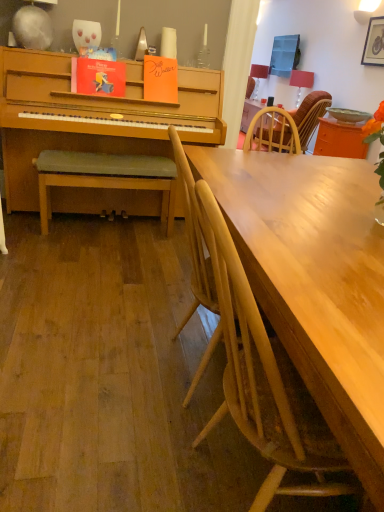
How much space does light wood chair at center, positioned as the 2th chair in front-to-back order, occupy horizontally?

20.78 inches.

This screenshot has height=512, width=384. Find the location of `green fabric bench at left`. green fabric bench at left is located at coordinates (105, 177).

Image resolution: width=384 pixels, height=512 pixels. What are the coordinates of `green matte bowl at upper right` in the screenshot? It's located at (348, 115).

At what (x,y) coordinates should I click in order to perform the action: click on wooden textured chair at right, which is the first chair in back-to-front order. Please return your answer as a coordinate pair (x, y). Looking at the image, I should click on (289, 124).

Considering the positions of point (378, 42) and point (316, 108), is point (378, 42) closer or farther from the camera than point (316, 108)?

Clearly, point (378, 42) is more distant from the camera than point (316, 108).

Where is `picture frame to the right of wooden textured chair at right, placed as the first chair when sorted from right to left`? The width and height of the screenshot is (384, 512). picture frame to the right of wooden textured chair at right, placed as the first chair when sorted from right to left is located at coordinates (374, 42).

Is wooden picture frame at upper right to the right of wooden textured chair at right, arranged as the 1th chair when viewed from the top, from the viewer's perspective?

Yes, wooden picture frame at upper right is to the right of wooden textured chair at right, arranged as the 1th chair when viewed from the top.

In terms of size, does green matte bowl at upper right appear bigger or smaller than green fabric bench at left?

Considering their sizes, green matte bowl at upper right takes up less space than green fabric bench at left.

Considering the points (351, 109) and (148, 165), which point is behind, point (351, 109) or point (148, 165)?

Point (351, 109)

What are the coordinates of `bowl above the green fabric bench at left (from a real-world perspective)` in the screenshot? It's located at (348, 115).

Would you say green fabric bench at left is part of green matte bowl at upper right's contents?

That's incorrect, green fabric bench at left is not inside green matte bowl at upper right.

Considering the sizes of wooden textured chair at right, placed as the 3th chair when sorted from left to right, and green fabric bench at left in the image, is wooden textured chair at right, placed as the 3th chair when sorted from left to right, taller or shorter than green fabric bench at left?

In the image, wooden textured chair at right, placed as the 3th chair when sorted from left to right, appears to be taller than green fabric bench at left.

From the image's perspective, is wooden textured chair at right, placed as the first chair when sorted from right to left, positioned above or below green fabric bench at left?

wooden textured chair at right, placed as the first chair when sorted from right to left, is situated higher than green fabric bench at left in the image.

Locate an element on the screen. This screenshot has height=512, width=384. bench below the wooden textured chair at right, placed as the 3th chair when sorted from left to right (from the image's perspective) is located at coordinates (105, 177).

Considering the sizes of objects light wood chair at center, which is the 3th chair from right to left, and matte red lampshade at upper right, which ranks as the 1th lamp in top-to-bottom order, in the image provided, who is shorter, light wood chair at center, which is the 3th chair from right to left, or matte red lampshade at upper right, which ranks as the 1th lamp in top-to-bottom order,?

Standing shorter between the two is matte red lampshade at upper right, which ranks as the 1th lamp in top-to-bottom order.

Considering the positions of objects light wood chair at center, acting as the 1th chair starting from the left, and matte red lampshade at upper right, which is the first lamp from left to right, in the image provided, who is more to the left, light wood chair at center, acting as the 1th chair starting from the left, or matte red lampshade at upper right, which is the first lamp from left to right,?

Positioned to the left is light wood chair at center, acting as the 1th chair starting from the left.

What's the angular difference between light wood chair at center, positioned as the 2th chair in front-to-back order, and matte red lampshade at upper right, acting as the first lamp starting from the back,'s facing directions?

There is a 178-degree angle between the facing directions of light wood chair at center, positioned as the 2th chair in front-to-back order, and matte red lampshade at upper right, acting as the first lamp starting from the back.

Is light wood chair at center, which is the 3th chair from right to left, aimed at matte red lampshade at upper right, the second lamp viewed from the front?

No, light wood chair at center, which is the 3th chair from right to left, is not oriented towards matte red lampshade at upper right, the second lamp viewed from the front.

Considering the sizes of objects matte red lampshade at upper right, which appears as the 2th lamp when viewed from the left, and green fabric bench at left in the image provided, who is wider, matte red lampshade at upper right, which appears as the 2th lamp when viewed from the left, or green fabric bench at left?

Wider between the two is green fabric bench at left.

From the picture: Does matte red lampshade at upper right, the second lamp from the top, have a larger size compared to green fabric bench at left?

No, matte red lampshade at upper right, the second lamp from the top, is not bigger than green fabric bench at left.

From the image's perspective, is matte red lampshade at upper right, which appears as the 2th lamp when viewed from the left, located above green fabric bench at left?

Yes.

Consider the image. From a real-world perspective, is matte red lampshade at upper right, which is counted as the 1th lamp, starting from the right, physically below wooden picture frame at upper right?

Correct, in the physical world, matte red lampshade at upper right, which is counted as the 1th lamp, starting from the right, is lower than wooden picture frame at upper right.

Locate an element on the screen. picture frame below the matte red lampshade at upper right, which appears as the first lamp when viewed from the front (from the image's perspective) is located at coordinates (374, 42).

Is matte red lampshade at upper right, the second lamp from the top, to the right of wooden picture frame at upper right from the viewer's perspective?

No.

Based on the photo, from the image's perspective, does green matte bowl at upper right appear higher than light wood chair at center, which is the 3th chair from right to left?

Yes, from the image's perspective, green matte bowl at upper right is on top of light wood chair at center, which is the 3th chair from right to left.

From a real-world perspective, who is located higher, green matte bowl at upper right or light wood chair at center, the second chair when ordered from top to bottom?

In real-world perspective, green matte bowl at upper right is above.

Considering the positions of objects green matte bowl at upper right and light wood chair at center, acting as the 1th chair starting from the left, in the image provided, who is more to the left, green matte bowl at upper right or light wood chair at center, acting as the 1th chair starting from the left,?

From the viewer's perspective, light wood chair at center, acting as the 1th chair starting from the left, appears more on the left side.

Considering the sizes of objects green matte bowl at upper right and light wood chair at center, acting as the second chair starting from the back, in the image provided, who is smaller, green matte bowl at upper right or light wood chair at center, acting as the second chair starting from the back,?

With smaller size is green matte bowl at upper right.

This screenshot has width=384, height=512. I want to click on picture frame in front of the wooden textured chair at right, placed as the first chair when sorted from right to left, so click(x=374, y=42).

You are a GUI agent. You are given a task and a screenshot of the screen. Output one action in this format:
    pyautogui.click(x=<x>, y=<y>)
    Task: Click on the bowl lying on the right of green fabric bench at left
    This screenshot has height=512, width=384.
    Given the screenshot: What is the action you would take?
    pyautogui.click(x=348, y=115)

Based on the photo, when comparing their distances from wooden picture frame at upper right, does green fabric bench at left or light wood chair at center, the 3th chair viewed from the top, seem further?

light wood chair at center, the 3th chair viewed from the top.

Which object lies further to the anchor point matte red lampshade at upper right, acting as the first lamp starting from the back, matte red lampshade at upper right, which is counted as the 2th lamp, starting from the back, or light wood chair at center, arranged as the third chair when viewed from the back?

light wood chair at center, arranged as the third chair when viewed from the back.

From the image, which object appears to be nearer to light wood chair at center, which ranks as the second chair in right-to-left order, matte red lampshade at upper right, which is counted as the 2th lamp, starting from the back, or orange glossy table at upper right?

orange glossy table at upper right lies closer to light wood chair at center, which ranks as the second chair in right-to-left order, than the other object.

Which object lies further to the anchor point matte red lampshade at upper right, arranged as the second lamp when viewed from the right, matte red lampshade at upper right, which is counted as the 1th lamp, starting from the right, or green matte bowl at upper right?

green matte bowl at upper right.

Based on their spatial positions, is matte red lampshade at upper right, the second lamp viewed from the front, or wooden textured chair at right, placed as the 3th chair when sorted from left to right, closer to green fabric bench at left?

wooden textured chair at right, placed as the 3th chair when sorted from left to right.

When comparing their distances from light wood chair at center, positioned as the 2th chair in front-to-back order, does light wood chair at center, marked as the 1th chair in a front-to-back arrangement, or orange glossy table at upper right seem closer?

Based on the image, light wood chair at center, marked as the 1th chair in a front-to-back arrangement, appears to be nearer to light wood chair at center, positioned as the 2th chair in front-to-back order.

Considering their positions, is green matte bowl at upper right positioned further to green fabric bench at left than matte red lampshade at upper right, acting as the first lamp starting from the back?

matte red lampshade at upper right, acting as the first lamp starting from the back, lies further to green fabric bench at left than the other object.

Consider the image. Which object lies further to the anchor point matte red lampshade at upper right, which is counted as the 2th lamp, starting from the back, wooden picture frame at upper right or light wood chair at center, acting as the 1th chair starting from the left?

light wood chair at center, acting as the 1th chair starting from the left, is further to matte red lampshade at upper right, which is counted as the 2th lamp, starting from the back.

At what (x,y) coordinates should I click in order to perform the action: click on bowl between wooden picture frame at upper right and orange glossy table at upper right vertically. Please return your answer as a coordinate pair (x, y). The width and height of the screenshot is (384, 512). Looking at the image, I should click on (348, 115).

Find the location of `bowl between wooden picture frame at upper right and matte red lampshade at upper right, which is counted as the 1th lamp, starting from the right, from front to back`. bowl between wooden picture frame at upper right and matte red lampshade at upper right, which is counted as the 1th lamp, starting from the right, from front to back is located at coordinates (348, 115).

This screenshot has width=384, height=512. I want to click on bench between light wood chair at center, positioned as the 2th chair in left-to-right order, and wooden textured chair at right, positioned as the third chair in bottom-to-top order, from front to back, so coord(105,177).

Where is `picture frame located between light wood chair at center, acting as the second chair starting from the back, and matte red lampshade at upper right, which ranks as the second lamp in bottom-to-top order, in the depth direction`? The image size is (384, 512). picture frame located between light wood chair at center, acting as the second chair starting from the back, and matte red lampshade at upper right, which ranks as the second lamp in bottom-to-top order, in the depth direction is located at coordinates (374, 42).